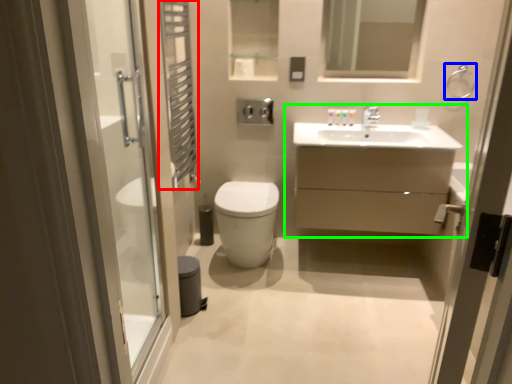
Question: Which is farther away from shower curtain (highlighted by a red box)? shower (highlighted by a blue box) or bathroom cabinet (highlighted by a green box)?

Choices:
 (A) shower
 (B) bathroom cabinet

Answer: (A)